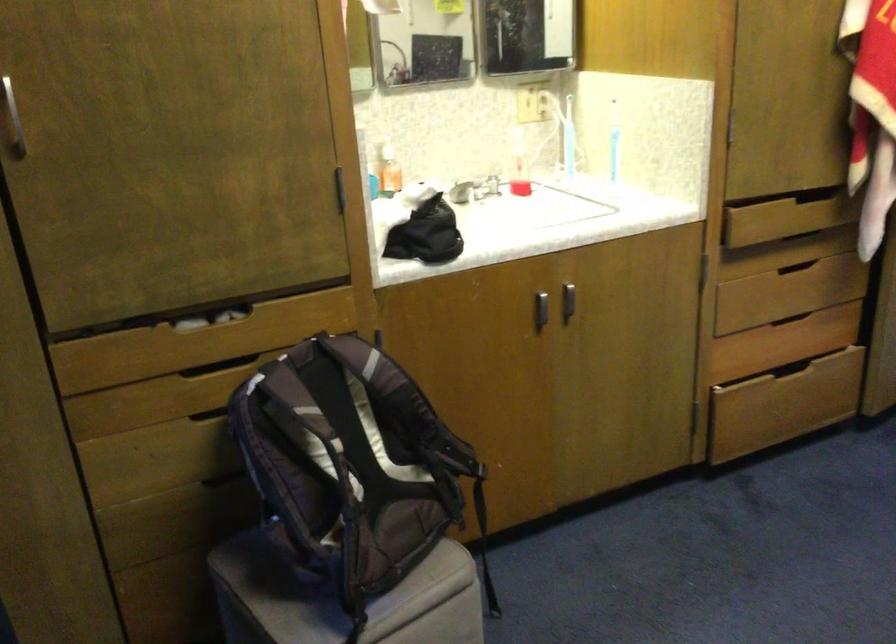
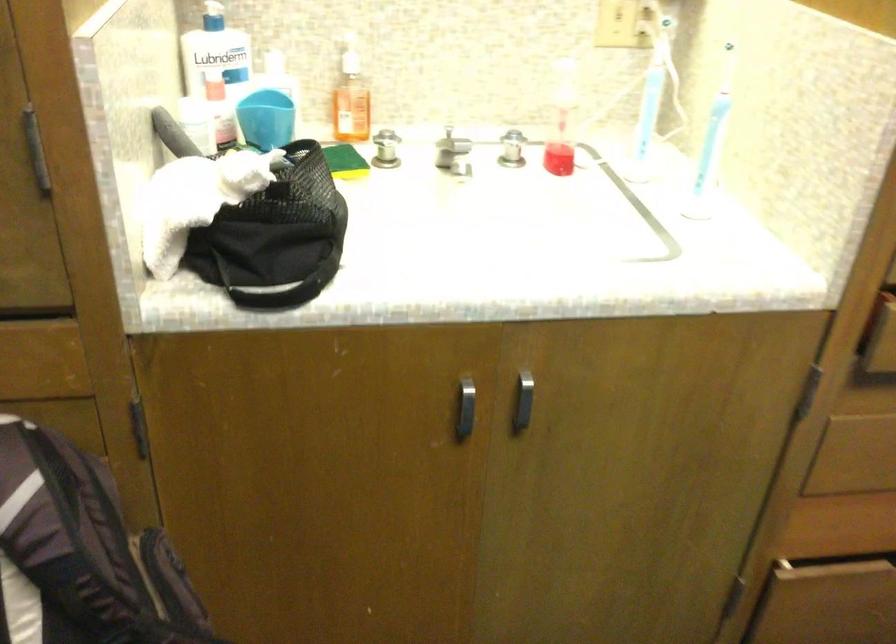
The point at [615,151] is marked in the first image. Where is the corresponding point in the second image?

(711, 144)